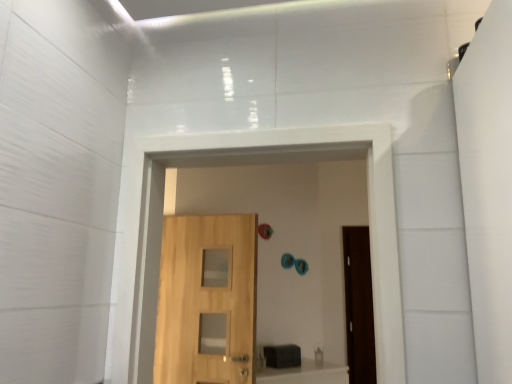
Question: Is light wood door at center in front of or behind natural wood door at center in the image?

Choices:
 (A) front
 (B) behind

Answer: (B)

Question: In terms of height, does light wood door at center look taller or shorter compared to natural wood door at center?

Choices:
 (A) tall
 (B) short

Answer: (A)

Question: Based on their positions, is light wood door at center located to the left or right of natural wood door at center?

Choices:
 (A) right
 (B) left

Answer: (B)

Question: Looking at the image, does natural wood door at center seem bigger or smaller compared to light wood door at center?

Choices:
 (A) small
 (B) big

Answer: (B)

Question: In terms of width, does natural wood door at center look wider or thinner when compared to light wood door at center?

Choices:
 (A) wide
 (B) thin

Answer: (A)

Question: Would you say natural wood door at center is inside or outside light wood door at center?

Choices:
 (A) outside
 (B) inside

Answer: (A)

Question: In the image, is natural wood door at center on the left side or the right side of light wood door at center?

Choices:
 (A) left
 (B) right

Answer: (B)